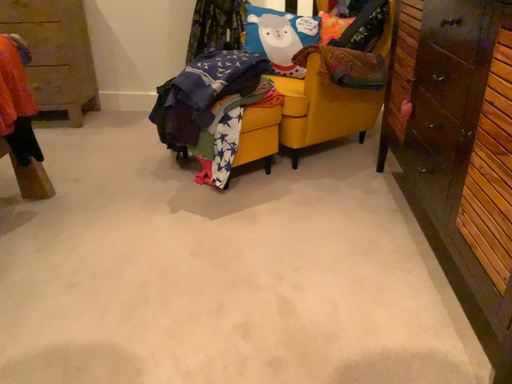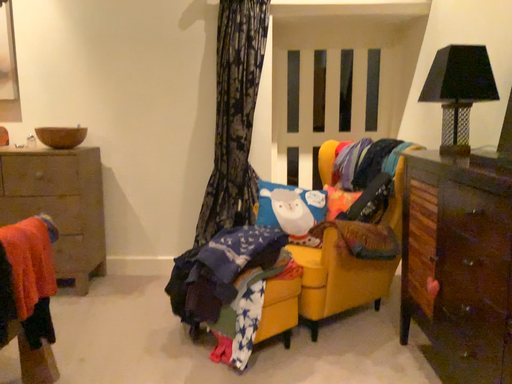
Question: Which way did the camera rotate in the video?

Choices:
 (A) rotated downward
 (B) rotated upward

Answer: (B)